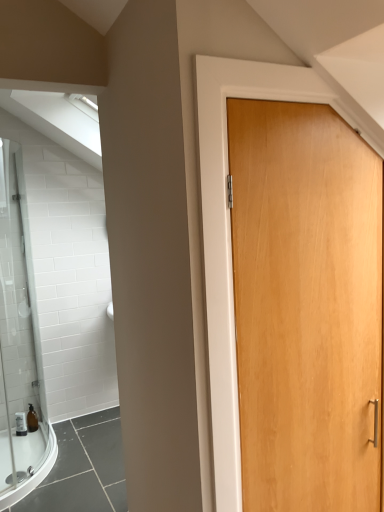
Measure the distance between point (340, 123) and camera.

Point (340, 123) and camera are 3.80 feet apart from each other.

The height and width of the screenshot is (512, 384). Describe the element at coordinates (305, 306) in the screenshot. I see `light brown wood door at center` at that location.

Identify the location of light brown wood door at center. This screenshot has width=384, height=512. (305, 306).

What is the approximate height of light brown wood door at center?

It is 1.40 meters.

What do you see at coordinates (32, 419) in the screenshot? I see `translucent amber bottle at lower left` at bounding box center [32, 419].

Image resolution: width=384 pixels, height=512 pixels. Find the location of `translucent amber bottle at lower left`. translucent amber bottle at lower left is located at coordinates (32, 419).

Where is `light brown wood door at center`? light brown wood door at center is located at coordinates (305, 306).

In the scene shown: Considering the positions of objects light brown wood door at center and translucent amber bottle at lower left in the image provided, who is more to the right, light brown wood door at center or translucent amber bottle at lower left?

From the viewer's perspective, light brown wood door at center appears more on the right side.

Which object is further away from the camera taking this photo, light brown wood door at center or translucent amber bottle at lower left?

translucent amber bottle at lower left.

Which is closer, (251,309) or (27,425)?

Point (251,309) appears to be closer to the viewer than point (27,425).

From the image's perspective, who appears lower, light brown wood door at center or translucent amber bottle at lower left?

From the image's view, translucent amber bottle at lower left is below.

From a real-world perspective, does light brown wood door at center sit lower than translucent amber bottle at lower left?

No.

Is light brown wood door at center wider than translucent amber bottle at lower left?

In fact, light brown wood door at center might be narrower than translucent amber bottle at lower left.

Which of these two, light brown wood door at center or translucent amber bottle at lower left, stands shorter?

translucent amber bottle at lower left is shorter.

Considering the relative sizes of light brown wood door at center and translucent amber bottle at lower left in the image provided, is light brown wood door at center smaller than translucent amber bottle at lower left?

Actually, light brown wood door at center might be larger than translucent amber bottle at lower left.

Is translucent amber bottle at lower left inside light brown wood door at center?

That's incorrect, translucent amber bottle at lower left is not inside light brown wood door at center.

Is light brown wood door at center far away from translucent amber bottle at lower left?

Indeed, light brown wood door at center is not near translucent amber bottle at lower left.

From the picture: Is light brown wood door at center oriented away from translucent amber bottle at lower left?

Yes, light brown wood door at center is facing away from translucent amber bottle at lower left.

Can you tell me how much light brown wood door at center and translucent amber bottle at lower left differ in facing direction?

light brown wood door at center and translucent amber bottle at lower left are facing 0.985 degrees away from each other.

How far apart are light brown wood door at center and translucent amber bottle at lower left?

A distance of 2.65 meters exists between light brown wood door at center and translucent amber bottle at lower left.

You are a GUI agent. You are given a task and a screenshot of the screen. Output one action in this format:
    pyautogui.click(x=<x>, y=<y>)
    Task: Click on the toiletry lying on the left of light brown wood door at center
    
    Given the screenshot: What is the action you would take?
    pyautogui.click(x=32, y=419)

Is translucent amber bottle at lower left at the right side of light brown wood door at center?

No.

Which object is closer to the camera taking this photo, translucent amber bottle at lower left or light brown wood door at center?

light brown wood door at center is more forward.

Is point (37, 423) positioned after point (350, 200)?

Yes, point (37, 423) is farther from viewer.

From the image's perspective, is translucent amber bottle at lower left located above light brown wood door at center?

No.

From a real-world perspective, which is physically above, translucent amber bottle at lower left or light brown wood door at center?

light brown wood door at center, from a real-world perspective.

Between translucent amber bottle at lower left and light brown wood door at center, which one has smaller width?

light brown wood door at center is thinner.

Which of these two, translucent amber bottle at lower left or light brown wood door at center, stands taller?

light brown wood door at center.

Does translucent amber bottle at lower left have a larger size compared to light brown wood door at center?

No, translucent amber bottle at lower left is not bigger than light brown wood door at center.

Is light brown wood door at center surrounded by translucent amber bottle at lower left?

No.

Looking at this image, does translucent amber bottle at lower left touch light brown wood door at center?

No, translucent amber bottle at lower left is not making contact with light brown wood door at center.

Is light brown wood door at center at the back of translucent amber bottle at lower left?

translucent amber bottle at lower left is not turned away from light brown wood door at center.

This screenshot has height=512, width=384. I want to click on toiletry below the light brown wood door at center (from the image's perspective), so click(32, 419).

Locate an element on the screen. The width and height of the screenshot is (384, 512). toiletry that appears behind the light brown wood door at center is located at coordinates (32, 419).

You are a GUI agent. You are given a task and a screenshot of the screen. Output one action in this format:
    pyautogui.click(x=<x>, y=<y>)
    Task: Click on the toiletry lying below the light brown wood door at center (from the image's perspective)
    This screenshot has width=384, height=512.
    Given the screenshot: What is the action you would take?
    pyautogui.click(x=32, y=419)